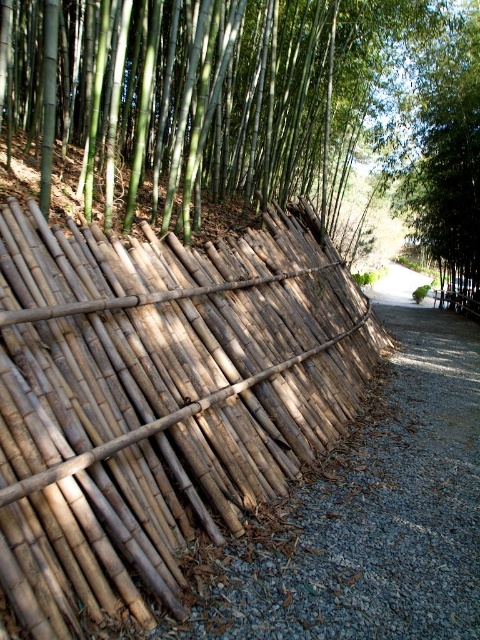
Does natural bamboo fence at left appear on the left side of green leafy tree at upper right?

Correct, you'll find natural bamboo fence at left to the left of green leafy tree at upper right.

Can you confirm if natural bamboo fence at left is positioned to the right of green leafy tree at upper right?

In fact, natural bamboo fence at left is to the left of green leafy tree at upper right.

Between point (97, 292) and point (456, 116), which one is positioned behind?

The point (456, 116) is behind.

Identify the location of natural bamboo fence at left. (158, 397).